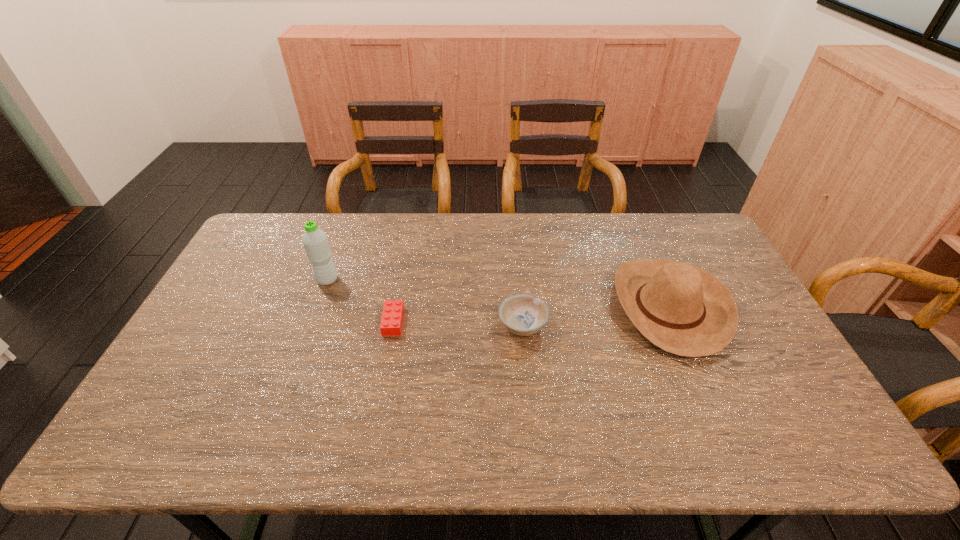
What are the coordinates of `vacant space located 0.270m on the front-facing side of the third shortest object` in the screenshot? It's located at (524, 307).

At what (x,y) coordinates should I click in order to perform the action: click on free space located on the front-facing side of the third shortest object. Please return your answer as a coordinate pair (x, y). This screenshot has width=960, height=540. Looking at the image, I should click on (515, 307).

Where is `vacant space located 0.280m on the front of the second object from right to left`? The height and width of the screenshot is (540, 960). vacant space located 0.280m on the front of the second object from right to left is located at coordinates (534, 441).

I want to click on vacant area situated 0.370m on the right of the shortest object, so click(x=530, y=321).

Where is `object that is positioned at the right edge`? object that is positioned at the right edge is located at coordinates (683, 309).

In order to click on free region at the far edge of the desktop in this screenshot , I will do `click(443, 215)`.

Where is `free location at the near edge of the desktop`? free location at the near edge of the desktop is located at coordinates (564, 440).

Identify the location of free space at the far right corner of the desktop. This screenshot has width=960, height=540. (661, 221).

Identify the location of vacant area that lies between the water bottle and the Lego. The image size is (960, 540). (360, 301).

Locate an element on the screen. This screenshot has height=540, width=960. free space between the second tallest object and the water bottle is located at coordinates (498, 293).